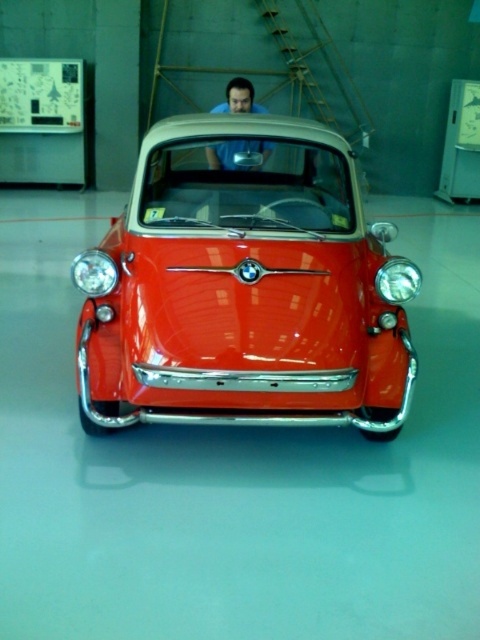
Find the location of a particular element. shiny red car at center is located at coordinates (244, 289).

Does shiny red car at center come behind blue matte shirt at center?

No, it is not.

Is point (127, 241) closer to camera compared to point (217, 112)?

Yes, it is in front of point (217, 112).

At what (x,y) coordinates should I click in order to perform the action: click on shiny red car at center. Please return your answer as a coordinate pair (x, y). The image size is (480, 640). Looking at the image, I should click on pyautogui.click(x=244, y=289).